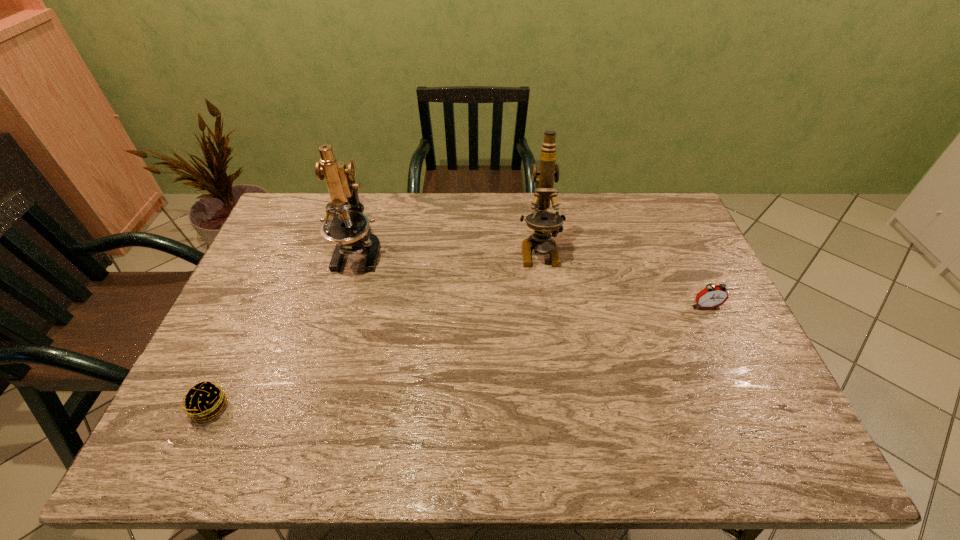
You are a GUI agent. You are given a task and a screenshot of the screen. Output one action in this format:
    pyautogui.click(x=<x>, y=<y>)
    Task: Click on the second object from left to right
    The image size is (960, 540).
    Given the screenshot: What is the action you would take?
    pyautogui.click(x=349, y=229)

At what (x,y) coordinates should I click in order to perform the action: click on the right microscope. Please return your answer as a coordinate pair (x, y). This screenshot has height=540, width=960. Looking at the image, I should click on (543, 222).

In order to click on the second shortest object in this screenshot , I will do `click(712, 296)`.

Identify the location of alarm clock. (712, 296).

This screenshot has height=540, width=960. What are the coordinates of `the nearest object` in the screenshot? It's located at (204, 400).

This screenshot has width=960, height=540. Identify the location of the leftmost object. (204, 400).

Identify the location of vacant region located 0.250m at the eyepiece of the left microscope. (331, 346).

This screenshot has width=960, height=540. What are the coordinates of `vacant region located on the right of the third object from left to right` in the screenshot? It's located at (604, 249).

You are a GUI agent. You are given a task and a screenshot of the screen. Output one action in this format:
    pyautogui.click(x=<x>, y=<y>)
    Task: Click on the vacant space situated 0.180m on the clock face of the rightmost object
    This screenshot has width=960, height=540.
    Given the screenshot: What is the action you would take?
    pyautogui.click(x=732, y=364)

Image resolution: width=960 pixels, height=540 pixels. Find the location of `vacant area situated 0.360m on the back of the patty`. vacant area situated 0.360m on the back of the patty is located at coordinates (266, 285).